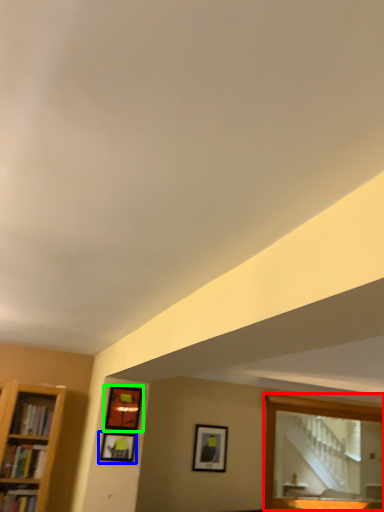
Question: Which object is the closest to the mirror (highlighted by a red box)? Choose among these: picture frame (highlighted by a blue box) or picture frame (highlighted by a green box).

Choices:
 (A) picture frame
 (B) picture frame

Answer: (B)